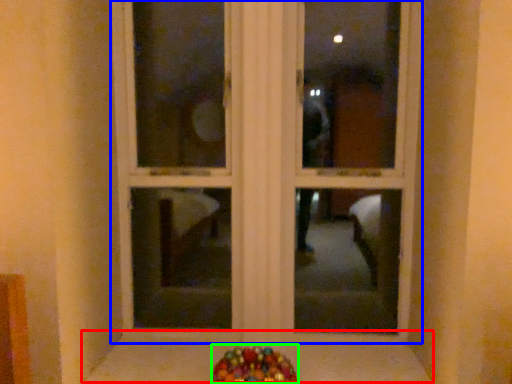
Question: Based on their relative distances, which object is nearer to window sill (highlighted by a red box)? Choose from window frame (highlighted by a blue box) and candy (highlighted by a green box).

Choices:
 (A) window frame
 (B) candy

Answer: (B)